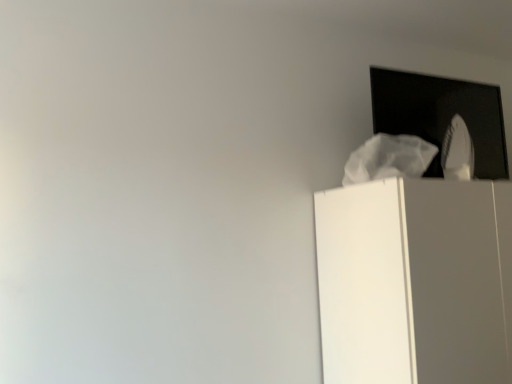
Question: Is point (440, 372) closer or farther from the camera than point (373, 87)?

Choices:
 (A) closer
 (B) farther

Answer: (A)

Question: Considering the positions of white matte cabinet at upper right and black glass window at upper right in the image, is white matte cabinet at upper right taller or shorter than black glass window at upper right?

Choices:
 (A) tall
 (B) short

Answer: (A)

Question: From a real-world perspective, is white matte cabinet at upper right positioned above or below black glass window at upper right?

Choices:
 (A) below
 (B) above

Answer: (A)

Question: From the image's perspective, is black glass window at upper right located above or below white matte cabinet at upper right?

Choices:
 (A) below
 (B) above

Answer: (B)

Question: Is black glass window at upper right bigger or smaller than white matte cabinet at upper right?

Choices:
 (A) big
 (B) small

Answer: (B)

Question: Is black glass window at upper right spatially inside white matte cabinet at upper right, or outside of it?

Choices:
 (A) outside
 (B) inside

Answer: (A)

Question: Considering their positions, is black glass window at upper right located in front of or behind white matte cabinet at upper right?

Choices:
 (A) front
 (B) behind

Answer: (B)